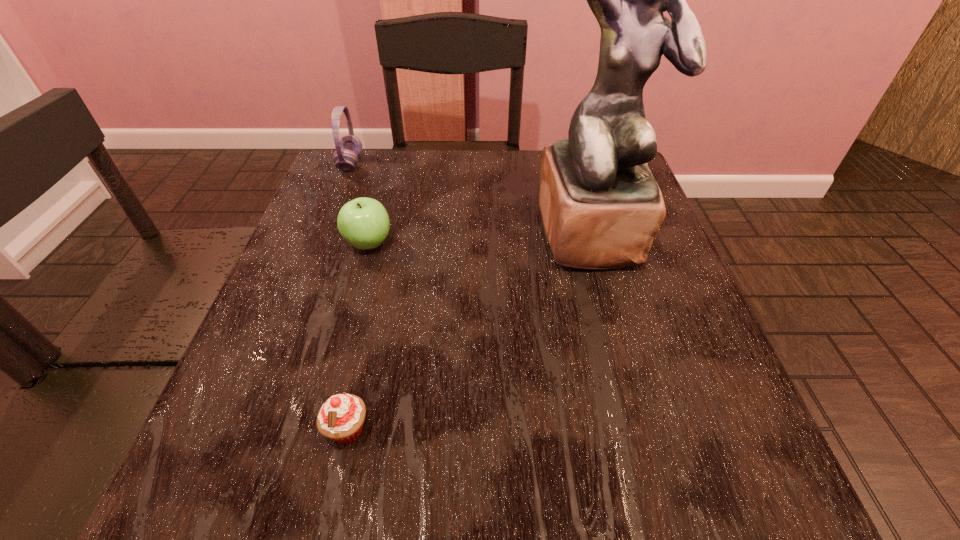
You are a GUI agent. You are given a task and a screenshot of the screen. Output one action in this format:
    pyautogui.click(x=<x>, y=<y>)
    Task: Click on the vacant point that satisfies the following two spatial constraints: 1. on the headband and ear cups of the farthest object; 2. on the right side of the nearest object
    
    Given the screenshot: What is the action you would take?
    pyautogui.click(x=246, y=429)

Where is `vacant area in the image that satisfies the following two spatial constraints: 1. on the headband and ear cups of the shortest object; 2. on the left side of the farthest object`? The width and height of the screenshot is (960, 540). vacant area in the image that satisfies the following two spatial constraints: 1. on the headband and ear cups of the shortest object; 2. on the left side of the farthest object is located at coordinates (246, 429).

The image size is (960, 540). Find the location of `blank area in the image that satisfies the following two spatial constraints: 1. on the headband and ear cups of the headset; 2. on the back side of the second shortest object`. blank area in the image that satisfies the following two spatial constraints: 1. on the headband and ear cups of the headset; 2. on the back side of the second shortest object is located at coordinates tap(319, 244).

The image size is (960, 540). I want to click on vacant space that satisfies the following two spatial constraints: 1. on the headband and ear cups of the headset; 2. on the left side of the apple, so click(319, 244).

Identify the location of vacant space that satisfies the following two spatial constraints: 1. on the headband and ear cups of the second shortest object; 2. on the left side of the third shortest object. (319, 244).

Find the location of `free location that satisfies the following two spatial constraints: 1. on the headband and ear cups of the farthest object; 2. on the back side of the apple`. free location that satisfies the following two spatial constraints: 1. on the headband and ear cups of the farthest object; 2. on the back side of the apple is located at coordinates (319, 244).